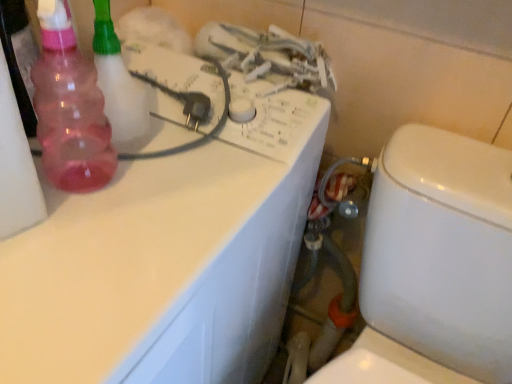
Measure the distance between pink translucent spray bottle at left and camera.

A distance of 19.48 inches exists between pink translucent spray bottle at left and camera.

Where is `white glossy counter top at upper left`? The width and height of the screenshot is (512, 384). white glossy counter top at upper left is located at coordinates (168, 259).

Image resolution: width=512 pixels, height=384 pixels. What do you see at coordinates (435, 264) in the screenshot? I see `white glossy toilet at lower right` at bounding box center [435, 264].

What is the approximate width of pink translucent bottle at left?

The width of pink translucent bottle at left is 4.02 inches.

What do you see at coordinates (69, 108) in the screenshot? I see `pink translucent bottle at left` at bounding box center [69, 108].

Find the location of a particular element. The image size is (512, 384). pink translucent spray bottle at left is located at coordinates click(117, 81).

Who is more distant, white glossy toilet at lower right or pink translucent bottle at left?

pink translucent bottle at left.

Are white glossy toilet at lower right and pink translucent bottle at left far apart?

No, white glossy toilet at lower right is not far from pink translucent bottle at left.

Is white glossy toilet at lower right oriented towards pink translucent bottle at left?

No, white glossy toilet at lower right does not turn towards pink translucent bottle at left.

Find the location of a particular element. This screenshot has height=384, width=512. bottle located on the left of white glossy toilet at lower right is located at coordinates (69, 108).

Considering the sizes of objects pink translucent bottle at left and pink translucent spray bottle at left in the image provided, who is taller, pink translucent bottle at left or pink translucent spray bottle at left?

Standing taller between the two is pink translucent bottle at left.

Who is smaller, pink translucent bottle at left or pink translucent spray bottle at left?

With smaller size is pink translucent spray bottle at left.

Is pink translucent bottle at left not inside pink translucent spray bottle at left?

Yes, pink translucent bottle at left is not within pink translucent spray bottle at left.

Locate an element on the screen. cleaning product on the right of pink translucent bottle at left is located at coordinates (117, 81).

How different are the orientations of pink translucent bottle at left and white glossy toilet at lower right in degrees?

The angular difference between pink translucent bottle at left and white glossy toilet at lower right is 92.5 degrees.

Visually, is pink translucent bottle at left positioned to the left or to the right of white glossy toilet at lower right?

From the image, it's evident that pink translucent bottle at left is to the left of white glossy toilet at lower right.

Could white glossy toilet at lower right be considered to be inside pink translucent bottle at left?

Definitely not — white glossy toilet at lower right is not inside pink translucent bottle at left.

Is pink translucent bottle at left facing towards white glossy toilet at lower right?

No, pink translucent bottle at left does not turn towards white glossy toilet at lower right.

Considering the relative sizes of white glossy toilet at lower right and pink translucent spray bottle at left in the image provided, is white glossy toilet at lower right bigger than pink translucent spray bottle at left?

Indeed, white glossy toilet at lower right has a larger size compared to pink translucent spray bottle at left.

Which of these two, white glossy toilet at lower right or pink translucent spray bottle at left, stands shorter?

pink translucent spray bottle at left is shorter.

Considering the relative sizes of white glossy toilet at lower right and pink translucent spray bottle at left in the image provided, is white glossy toilet at lower right thinner than pink translucent spray bottle at left?

No, white glossy toilet at lower right is not thinner than pink translucent spray bottle at left.

Measure the distance from rubber hose at lower center to white glossy counter top at upper left.

rubber hose at lower center is 12.28 inches from white glossy counter top at upper left.

From the image's perspective, which one is positioned lower, rubber hose at lower center or white glossy counter top at upper left?

white glossy counter top at upper left is shown below in the image.

Considering the relative positions of rubber hose at lower center and white glossy counter top at upper left in the image provided, is rubber hose at lower center in front of white glossy counter top at upper left?

That is False.

Between pink translucent spray bottle at left and white glossy counter top at upper left, which one is positioned in front?

white glossy counter top at upper left is in front.

Where is `counter top directly beneath the pink translucent spray bottle at left (from a real-world perspective)`? Image resolution: width=512 pixels, height=384 pixels. counter top directly beneath the pink translucent spray bottle at left (from a real-world perspective) is located at coordinates (168, 259).

From a real-world perspective, which is physically below, pink translucent spray bottle at left or white glossy counter top at upper left?

white glossy counter top at upper left is physically lower.

Which is closer, (123, 141) or (114, 225)?

The point (114, 225) is more forward.

In the image, is rubber hose at lower center positioned in front of or behind pink translucent bottle at left?

rubber hose at lower center is behind pink translucent bottle at left.

From the image's perspective, is rubber hose at lower center above or below pink translucent bottle at left?

rubber hose at lower center is situated lower than pink translucent bottle at left in the image.

Which of these two, rubber hose at lower center or pink translucent bottle at left, is smaller?

pink translucent bottle at left.

Does rubber hose at lower center have a lesser width compared to pink translucent bottle at left?

No, rubber hose at lower center is not thinner than pink translucent bottle at left.

Locate an element on the screen. The width and height of the screenshot is (512, 384). bottle on the left of white glossy toilet at lower right is located at coordinates (69, 108).

Locate an element on the screen. The image size is (512, 384). cleaning product that is behind the pink translucent bottle at left is located at coordinates (117, 81).

Looking at the image, which one is located further to rubber hose at lower center, pink translucent bottle at left or white glossy counter top at upper left?

Among the two, pink translucent bottle at left is located further to rubber hose at lower center.

Considering their positions, is rubber hose at lower center positioned further to pink translucent bottle at left than white glossy toilet at lower right?

Based on the image, rubber hose at lower center appears to be further to pink translucent bottle at left.

When comparing their distances from pink translucent spray bottle at left, does rubber hose at lower center or pink translucent bottle at left seem closer?

Based on the image, pink translucent bottle at left appears to be nearer to pink translucent spray bottle at left.

Which object lies nearer to the anchor point white glossy toilet at lower right, white glossy counter top at upper left or pink translucent bottle at left?

Among the two, white glossy counter top at upper left is located nearer to white glossy toilet at lower right.

Looking at this image, from the image, which object appears to be farther from white glossy toilet at lower right, pink translucent spray bottle at left or rubber hose at lower center?

Among the two, pink translucent spray bottle at left is located further to white glossy toilet at lower right.

When comparing their distances from rubber hose at lower center, does white glossy toilet at lower right or pink translucent bottle at left seem closer?

Based on the image, white glossy toilet at lower right appears to be nearer to rubber hose at lower center.

Considering their positions, is white glossy counter top at upper left positioned closer to pink translucent spray bottle at left than pink translucent bottle at left?

pink translucent bottle at left lies closer to pink translucent spray bottle at left than the other object.

From the image, which object appears to be farther from pink translucent spray bottle at left, rubber hose at lower center or white glossy toilet at lower right?

rubber hose at lower center.

This screenshot has height=384, width=512. What are the coordinates of `water pipe between pink translucent spray bottle at left and white glossy counter top at upper left in the up-down direction` in the screenshot? It's located at (312, 275).

Where is `counter top between white glossy toilet at lower right and rubber hose at lower center in the front-back direction`? This screenshot has height=384, width=512. counter top between white glossy toilet at lower right and rubber hose at lower center in the front-back direction is located at coordinates (168, 259).

This screenshot has height=384, width=512. Find the location of `water pipe between pink translucent bottle at left and white glossy toilet at lower right in the up-down direction`. water pipe between pink translucent bottle at left and white glossy toilet at lower right in the up-down direction is located at coordinates (312, 275).

Where is `cleaning product between pink translucent bottle at left and rubber hose at lower center from left to right`? Image resolution: width=512 pixels, height=384 pixels. cleaning product between pink translucent bottle at left and rubber hose at lower center from left to right is located at coordinates (117, 81).